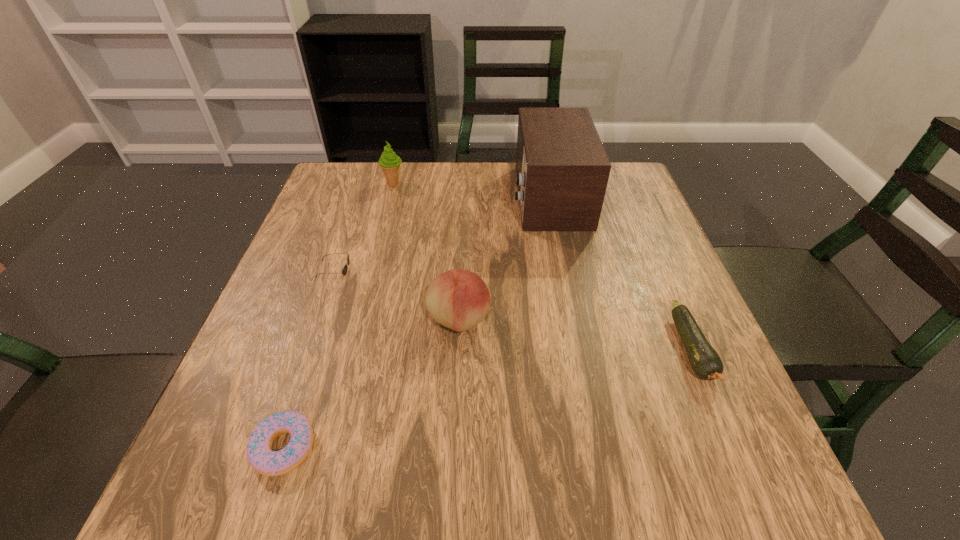
Find the location of `the second object from right to left`. the second object from right to left is located at coordinates (562, 170).

Find the location of a particular element. This screenshot has height=540, width=960. radio receiver is located at coordinates click(562, 170).

Locate an element on the screen. icecream is located at coordinates (390, 163).

This screenshot has height=540, width=960. I want to click on peach, so click(x=459, y=299).

You are a GUI agent. You are given a task and a screenshot of the screen. Output one action in this format:
    pyautogui.click(x=<x>, y=<y>)
    Task: Click on the fourth object from left to right
    
    Given the screenshot: What is the action you would take?
    pyautogui.click(x=459, y=299)

What are the coordinates of `the fourth tallest object` in the screenshot? It's located at (344, 271).

What are the coordinates of `zucchini` in the screenshot? It's located at (704, 360).

I want to click on the fifth tallest object, so (x=704, y=360).

You are a GUI agent. You are given a task and a screenshot of the screen. Output one action in this format:
    pyautogui.click(x=<x>, y=<y>)
    Task: Click on the doughnut
    This screenshot has width=960, height=540.
    Given the screenshot: What is the action you would take?
    pyautogui.click(x=259, y=452)

The height and width of the screenshot is (540, 960). Find the location of `the nearest object`. the nearest object is located at coordinates (259, 452).